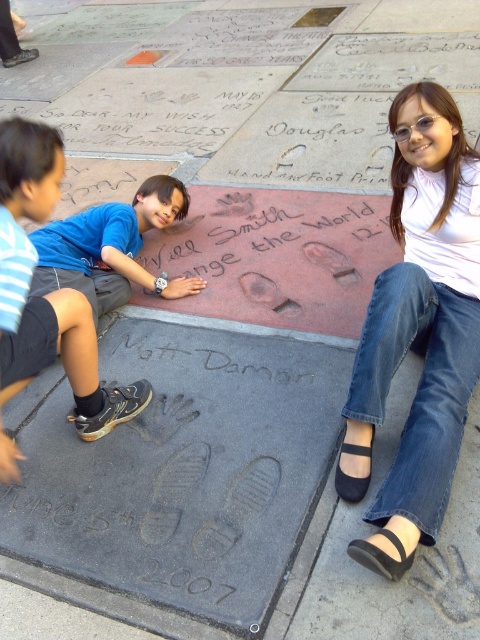
Based on the provided scene description, where is the blue fabric shirt at center located in terms of its 2D coordinates?

The blue fabric shirt at center is located at the 2D coordinates point [109,248].

Looking at this image, you are a photographer standing at the back of the scene. You need to capture a photo that includes both the blue fabric shirt at center and the black leather sandal at lower right without any obstruction. Based on their distance, what is the minimum focal length lens you should use if your camera sensor has a diagonal measurement of 24mm?

The blue fabric shirt at center and the black leather sandal at lower right are 1.80 meters apart. To capture both in the frame without obstruction, the minimum focal length required would depend on the distance from the camera to the subjects. However, without knowing the exact distance, we can calculate using the sensor size. The diagonal of the sensor is 24mm. Using the formula focal length < 24mm multiplied by distance divided by subject size. But since distance isn not provided, we can suggest a wide 2